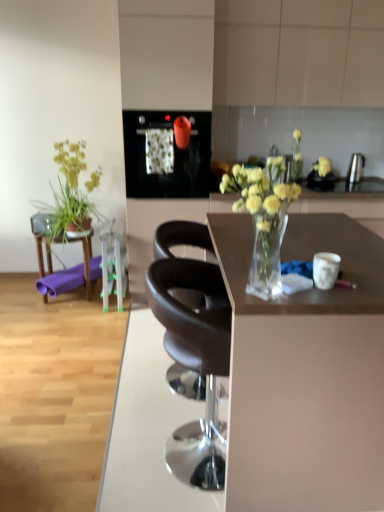
At what (x,y) coordinates should I click in order to perform the action: click on vacant area that is in front of satin silver kettle at upper right, which is counted as the second appliance, starting from the left. Please return your answer as a coordinate pair (x, y). Looking at the image, I should click on (361, 186).